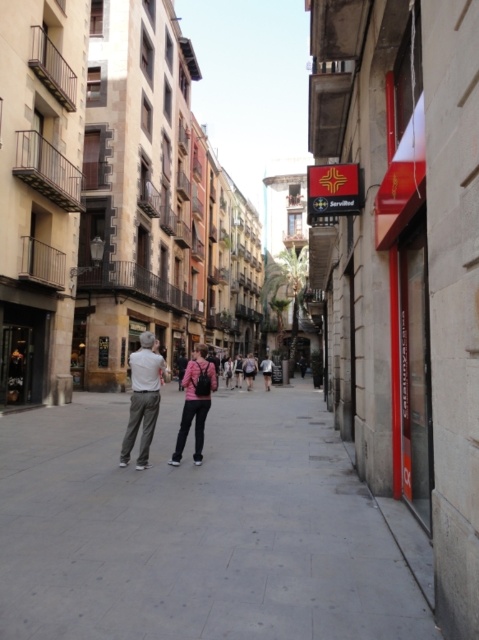
Does light pink fabric at center appear on the left side of light brown leather jacket at center?

Yes, light pink fabric at center is to the left of light brown leather jacket at center.

Which is behind, point (239, 381) or point (273, 365)?

The point (273, 365) is behind.

Which is in front, point (251, 355) or point (262, 364)?

Point (262, 364) is more forward.

Locate an element on the screen. This screenshot has width=479, height=640. light pink fabric at center is located at coordinates (244, 369).

Does point (146, 392) come behind point (248, 381)?

No, (146, 392) is closer to viewer.

Is khaki pants at center further to camera compared to light pink fabric at center?

That is False.

Find the location of a particular element. khaki pants at center is located at coordinates (143, 397).

The height and width of the screenshot is (640, 479). Identify the location of khaki pants at center. click(143, 397).

Is khaki pants at center thinner than light brown leather jacket at center?

Incorrect, khaki pants at center's width is not less than light brown leather jacket at center's.

In the scene shown: Can you confirm if khaki pants at center is wider than light brown leather jacket at center?

Yes, khaki pants at center is wider than light brown leather jacket at center.

Which is behind, point (154, 397) or point (262, 365)?

Point (262, 365)

Find the location of a particular element. The height and width of the screenshot is (640, 479). khaki pants at center is located at coordinates (143, 397).